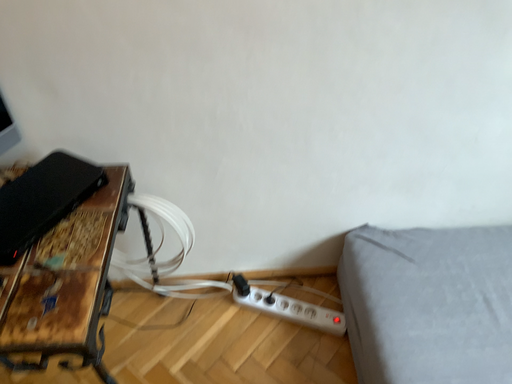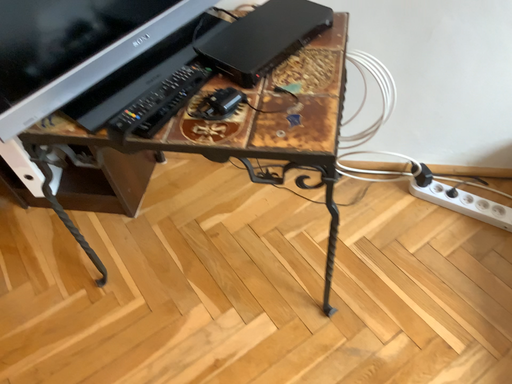
Question: Which way did the camera rotate in the video?

Choices:
 (A) rotated upward
 (B) rotated downward

Answer: (B)